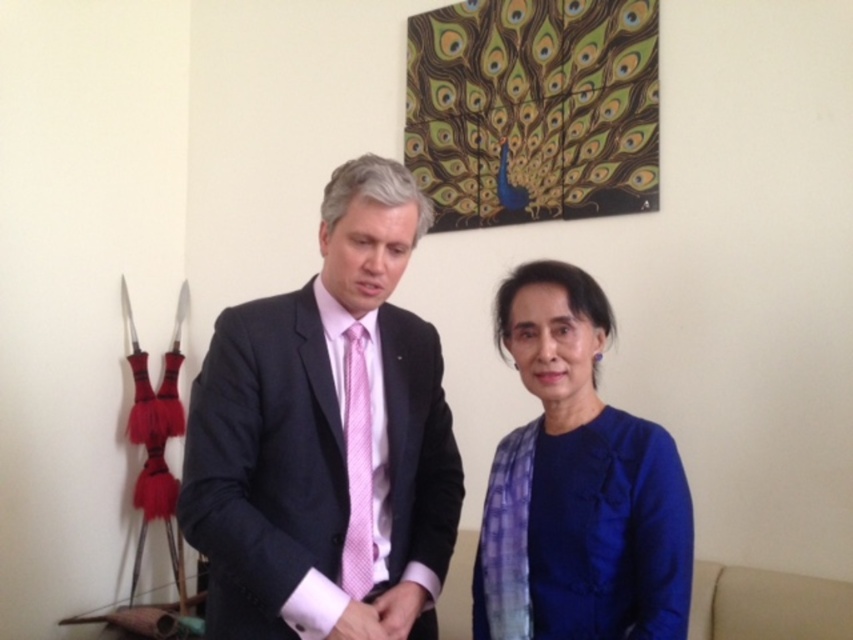
You are a tailor who needs to determine which garment requires more fabric to alter. Given that both the matte black suit at center and the blue cotton sweater at center are in front of you, which one would need more fabric for adjustments?

The matte black suit at center is bigger than the blue cotton sweater at center, so it would require more fabric for alterations.

You are a photographer setting up a shoot in the described scene. You need to place a small prop between the matte black suit at center and the blue cotton sweater at center. Based on their positions, which clothing item should the prop be closer to?

The prop should be placed closer to the blue cotton sweater at center because the matte black suit at center is positioned over it, meaning the blue cotton sweater at center is underneath and the prop would naturally be closer to the visible top layer.